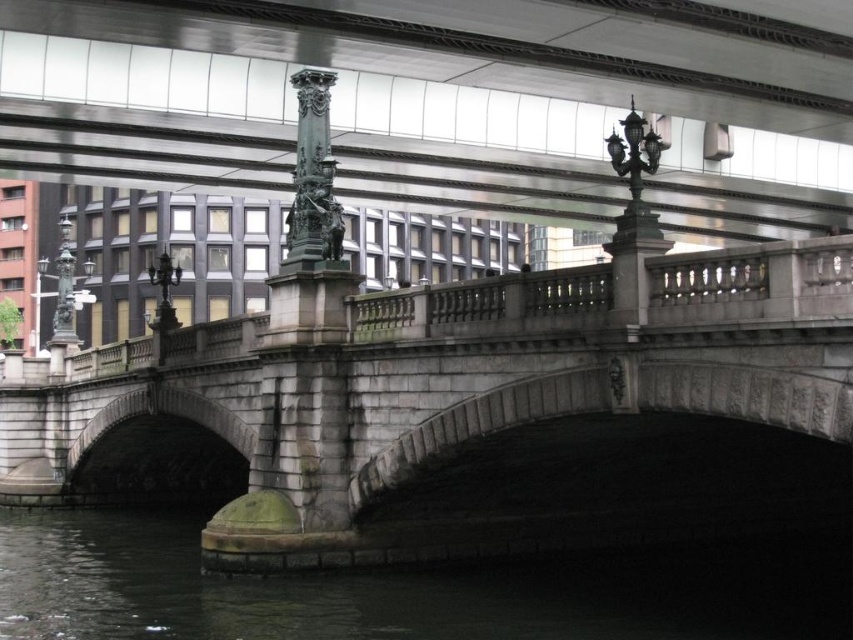
Question: Which point is farther to the camera?

Choices:
 (A) polished bronze statue at left
 (B) dark stone water at lower center
 (C) gray stone bridge at center
 (D) polished bronze lamp post at center

Answer: (A)

Question: Does dark stone water at lower center appear on the right side of bronze ornate column at center?

Choices:
 (A) yes
 (B) no

Answer: (B)

Question: Is gray stone bridge at center thinner than polished bronze statue at left?

Choices:
 (A) yes
 (B) no

Answer: (B)

Question: Does gray stone bridge at center come in front of polished bronze lamp post at center?

Choices:
 (A) yes
 (B) no

Answer: (A)

Question: Which object is closer to the camera taking this photo?

Choices:
 (A) polished bronze statue at left
 (B) bronze ornate column at center
 (C) gray stone bridge at center
 (D) polished bronze lamp post at center

Answer: (C)

Question: Which point appears closest to the camera in this image?

Choices:
 (A) (579, 403)
 (B) (654, 556)

Answer: (A)